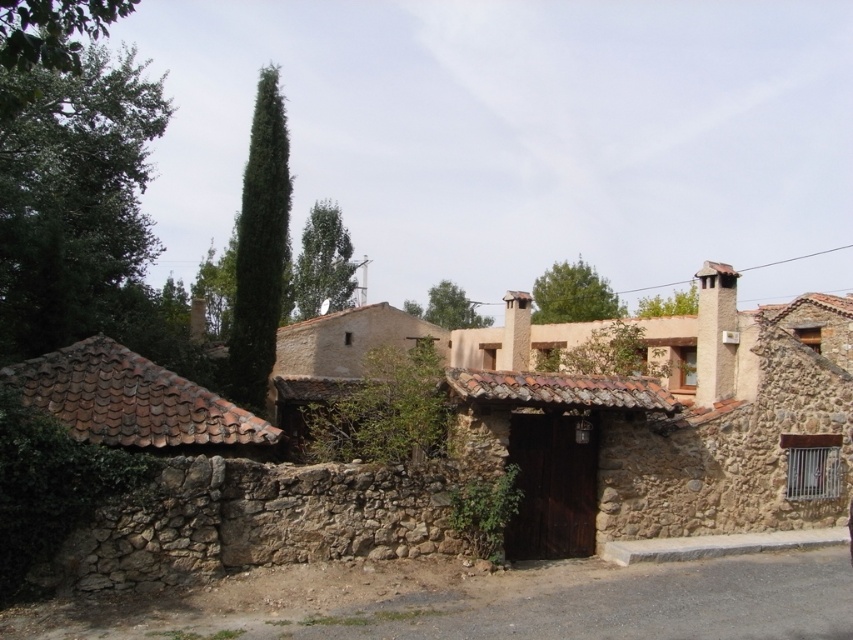
Does brown stone wall at center have a larger size compared to green leafy cypress at upper center?

No.

Which of these two, brown stone wall at center or green leafy cypress at upper center, stands taller?

green leafy cypress at upper center is taller.

Which is behind, point (851, 404) or point (248, 292)?

The point (248, 292) is more distant.

I want to click on brown stone wall at center, so click(668, 435).